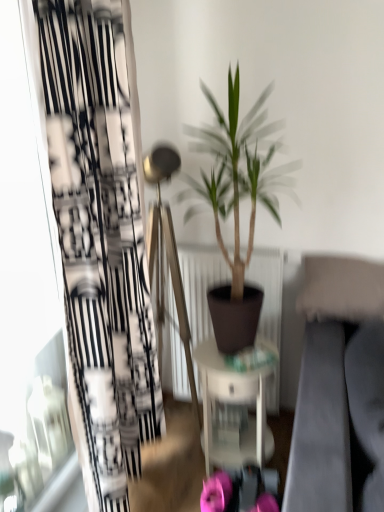
Question: Considering the relative sizes of green matte plant at center and black printed fabric curtain at left in the image provided, is green matte plant at center bigger than black printed fabric curtain at left?

Choices:
 (A) no
 (B) yes

Answer: (A)

Question: Is green matte plant at center further to camera compared to black printed fabric curtain at left?

Choices:
 (A) no
 (B) yes

Answer: (B)

Question: Does green matte plant at center have a greater height compared to black printed fabric curtain at left?

Choices:
 (A) no
 (B) yes

Answer: (A)

Question: From a real-world perspective, is green matte plant at center under black printed fabric curtain at left?

Choices:
 (A) no
 (B) yes

Answer: (B)

Question: Considering the relative sizes of green matte plant at center and black printed fabric curtain at left in the image provided, is green matte plant at center shorter than black printed fabric curtain at left?

Choices:
 (A) no
 (B) yes

Answer: (B)

Question: Is green matte plant at center at the left side of black printed fabric curtain at left?

Choices:
 (A) no
 (B) yes

Answer: (A)

Question: Are white glossy table at center and green matte plant at center beside each other?

Choices:
 (A) no
 (B) yes

Answer: (A)

Question: Does white glossy table at center appear on the left side of green matte plant at center?

Choices:
 (A) no
 (B) yes

Answer: (B)

Question: Does white glossy table at center have a greater width compared to green matte plant at center?

Choices:
 (A) no
 (B) yes

Answer: (A)

Question: From the image's perspective, is white glossy table at center located beneath green matte plant at center?

Choices:
 (A) yes
 (B) no

Answer: (A)

Question: Is white glossy table at center closer to camera compared to green matte plant at center?

Choices:
 (A) yes
 (B) no

Answer: (B)

Question: Does white glossy table at center have a lesser height compared to green matte plant at center?

Choices:
 (A) no
 (B) yes

Answer: (B)

Question: Is pink fabric flower at lower center, the first flower viewed from the left, not within green matte plant at center?

Choices:
 (A) yes
 (B) no

Answer: (A)